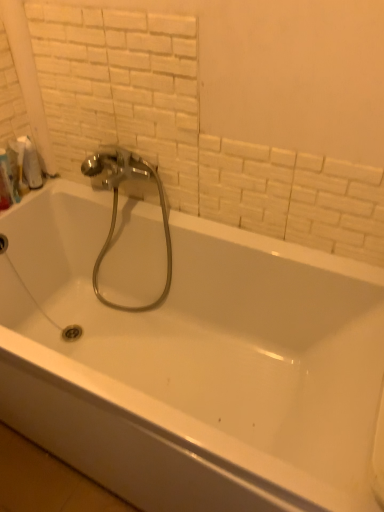
Question: Considering the relative sizes of white glossy bathtub at center and white plastic bottle at upper left in the image provided, is white glossy bathtub at center smaller than white plastic bottle at upper left?

Choices:
 (A) no
 (B) yes

Answer: (A)

Question: Considering the relative sizes of white glossy bathtub at center and white plastic bottle at upper left in the image provided, is white glossy bathtub at center thinner than white plastic bottle at upper left?

Choices:
 (A) no
 (B) yes

Answer: (A)

Question: From the image's perspective, is white glossy bathtub at center located beneath white plastic bottle at upper left?

Choices:
 (A) yes
 (B) no

Answer: (A)

Question: Considering the relative sizes of white glossy bathtub at center and white plastic bottle at upper left in the image provided, is white glossy bathtub at center bigger than white plastic bottle at upper left?

Choices:
 (A) no
 (B) yes

Answer: (B)

Question: Does white glossy bathtub at center appear on the right side of white plastic bottle at upper left?

Choices:
 (A) yes
 (B) no

Answer: (A)

Question: Is white glossy bathtub at center further to the viewer compared to white plastic bottle at upper left?

Choices:
 (A) yes
 (B) no

Answer: (B)

Question: Is the position of white matte toilet paper at upper left more distant than that of white plastic bottle at upper left?

Choices:
 (A) no
 (B) yes

Answer: (B)

Question: Is white plastic bottle at upper left at the back of white matte toilet paper at upper left?

Choices:
 (A) yes
 (B) no

Answer: (B)

Question: From the image's perspective, is white matte toilet paper at upper left on white plastic bottle at upper left?

Choices:
 (A) yes
 (B) no

Answer: (A)

Question: Does white matte toilet paper at upper left come in front of white plastic bottle at upper left?

Choices:
 (A) yes
 (B) no

Answer: (B)

Question: Considering the relative sizes of white matte toilet paper at upper left and white plastic bottle at upper left in the image provided, is white matte toilet paper at upper left wider than white plastic bottle at upper left?

Choices:
 (A) no
 (B) yes

Answer: (B)

Question: Is white matte toilet paper at upper left thinner than white plastic bottle at upper left?

Choices:
 (A) yes
 (B) no

Answer: (B)

Question: Does white glossy bathtub at center have a lesser height compared to white matte toilet paper at upper left?

Choices:
 (A) yes
 (B) no

Answer: (B)